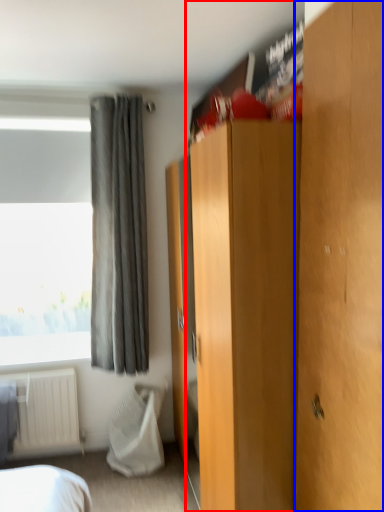
Question: Which object appears closest to the camera in this image, dresser (highlighted by a red box) or door (highlighted by a blue box)?

Choices:
 (A) dresser
 (B) door

Answer: (B)